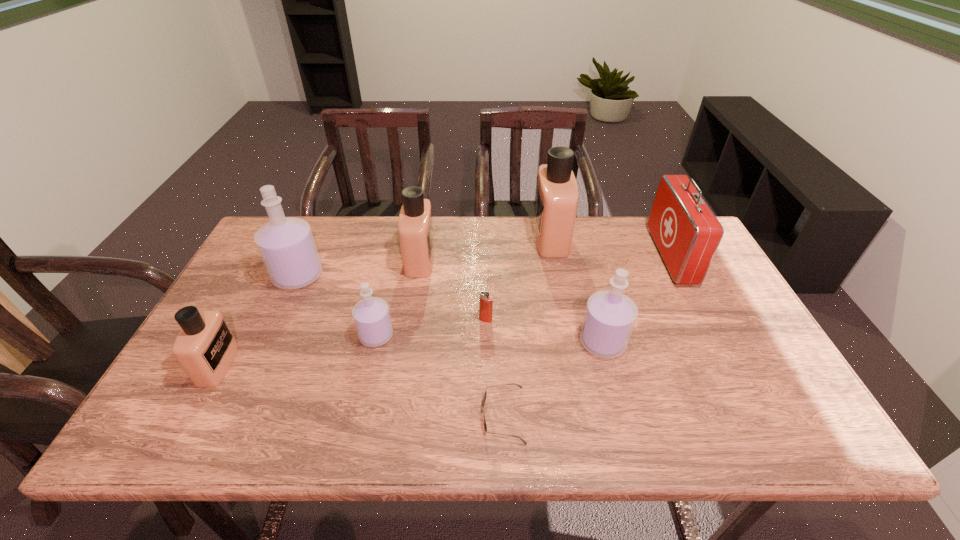
You are a GUI agent. You are given a task and a screenshot of the screen. Output one action in this format:
    pyautogui.click(x=<x>, y=<y>)
    Task: Click on the biggest beige perfume
    
    Given the screenshot: What is the action you would take?
    pyautogui.click(x=556, y=200)

The image size is (960, 540). Identify the location of the leftmost purple perfume. (286, 244).

Where is `the farthest purple perfume`? the farthest purple perfume is located at coordinates point(286,244).

This screenshot has width=960, height=540. Find the location of `the first-aid kit`. the first-aid kit is located at coordinates (686, 232).

This screenshot has width=960, height=540. I want to click on red first-aid kit, so click(686, 232).

Where is `the second beige perfume from left to right`? Image resolution: width=960 pixels, height=540 pixels. the second beige perfume from left to right is located at coordinates (415, 224).

Identify the location of the rightmost purple perfume. The height and width of the screenshot is (540, 960). (609, 318).

Identify the location of the smallest purple perfume. The image size is (960, 540). (371, 315).

Where is `the smallest beige perfume`? the smallest beige perfume is located at coordinates (205, 348).

Where is `the nearest beige perfume`? the nearest beige perfume is located at coordinates (205, 348).